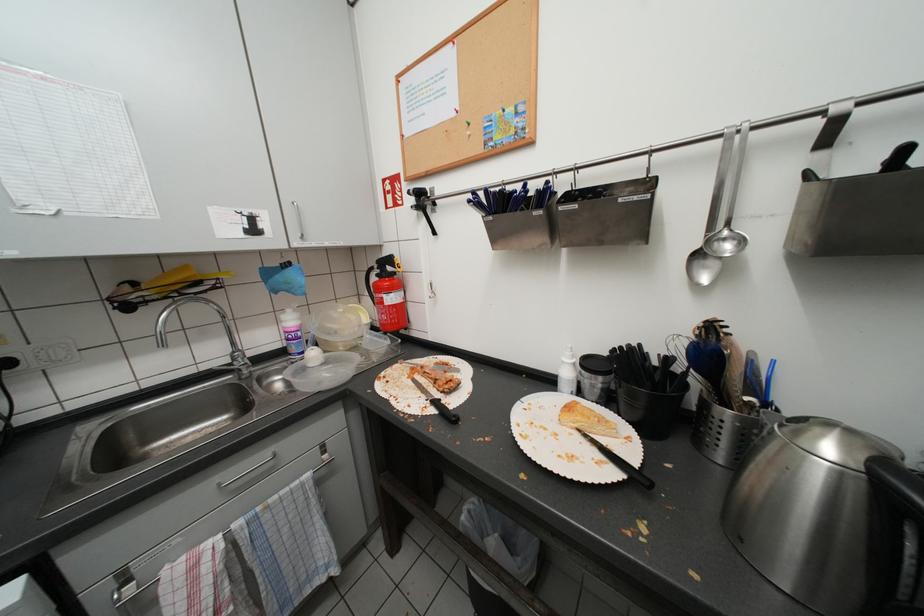
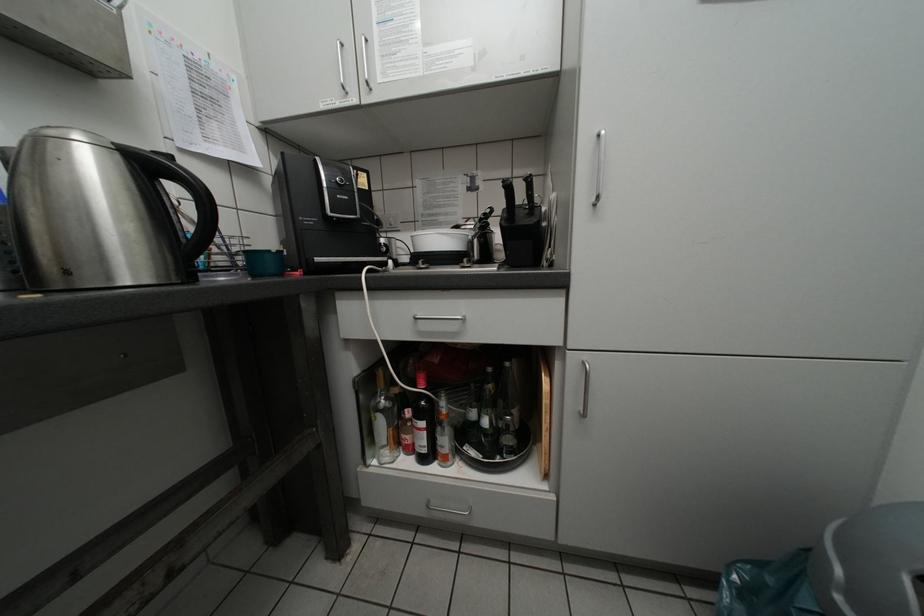
Question: The camera is either moving clockwise (left) or counter-clockwise (right) around the object. The first image is from the beginning of the video and the second image is from the end. Is the camera moving left or right when shooting the video?

Choices:
 (A) Left
 (B) Right

Answer: (A)